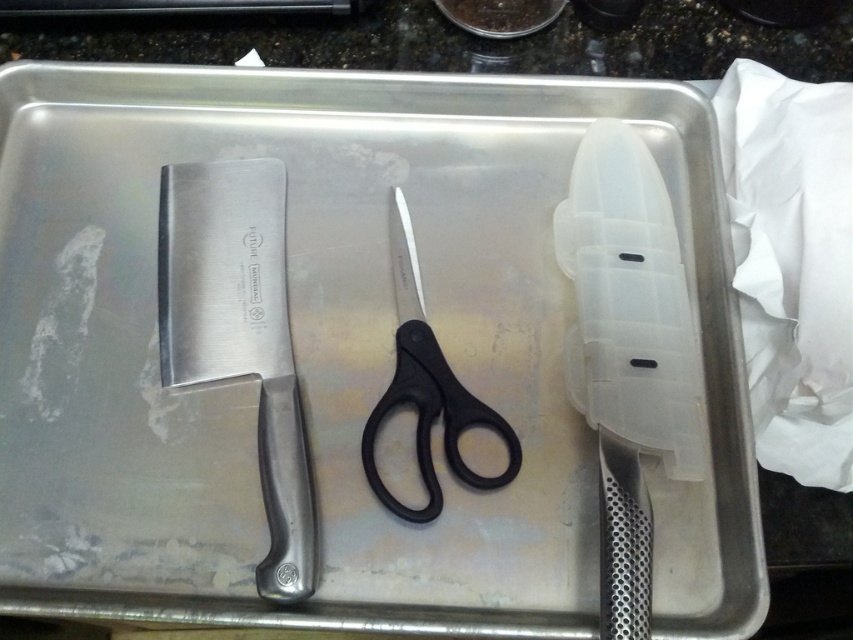
Between point (647, 259) and point (419, 424), which one is positioned behind?

Point (647, 259)

Does transparent plastic razor at center have a lesser height compared to black plastic scissors at center?

In fact, transparent plastic razor at center may be taller than black plastic scissors at center.

Between point (618, 486) and point (410, 291), which one is positioned in front?

Point (618, 486) is in front.

Where is `transparent plastic razor at center`? The width and height of the screenshot is (853, 640). transparent plastic razor at center is located at coordinates (628, 353).

Does transparent plastic razor at center come behind polished metal knife at left?

No, transparent plastic razor at center is closer to the viewer.

The image size is (853, 640). I want to click on transparent plastic razor at center, so click(x=628, y=353).

What do you see at coordinates (628, 353) in the screenshot? I see `transparent plastic razor at center` at bounding box center [628, 353].

This screenshot has height=640, width=853. In order to click on transparent plastic razor at center in this screenshot , I will do `click(628, 353)`.

Is polished metal knife at left thinner than black plastic scissors at center?

In fact, polished metal knife at left might be wider than black plastic scissors at center.

Which is behind, point (263, 272) or point (405, 228)?

Positioned behind is point (405, 228).

Locate an element on the screen. polished metal knife at left is located at coordinates (241, 333).